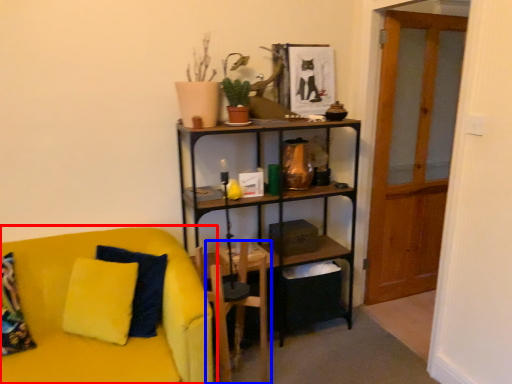
Question: Among these objects, which one is nearest to the camera, studio couch (highlighted by a red box) or armchair (highlighted by a blue box)?

Choices:
 (A) studio couch
 (B) armchair

Answer: (A)